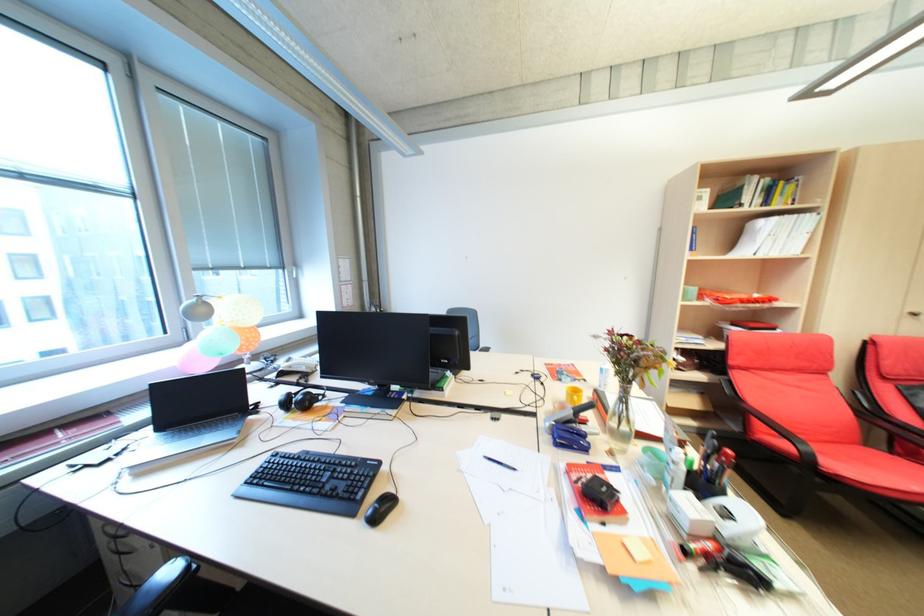
Identify the location of black chair armrest. This screenshot has height=616, width=924. (160, 586).